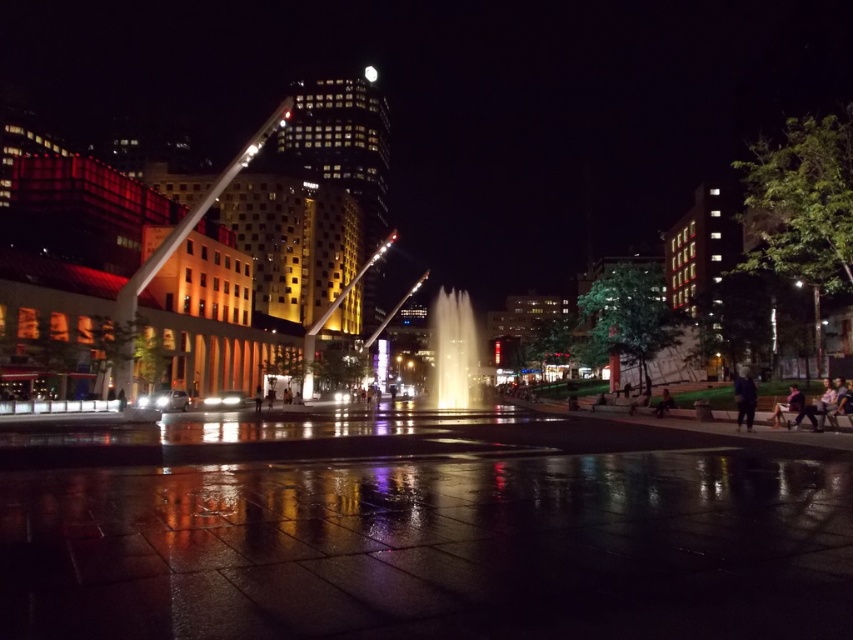
Is illuminated glass fountain at center bigger than white glossy light at center?

Correct, illuminated glass fountain at center is larger in size than white glossy light at center.

Does illuminated glass fountain at center have a greater width compared to white glossy light at center?

Indeed, illuminated glass fountain at center has a greater width compared to white glossy light at center.

Between point (474, 392) and point (373, 67), which one is positioned behind?

Point (373, 67)

Find the location of a particular element. illuminated glass fountain at center is located at coordinates (453, 353).

What do you see at coordinates (744, 397) in the screenshot?
I see `dark blue fabric at lower right` at bounding box center [744, 397].

Does dark blue fabric at lower right have a larger size compared to white glossy light at center?

Incorrect, dark blue fabric at lower right is not larger than white glossy light at center.

Between point (735, 410) and point (368, 80), which one is positioned in front?

Positioned in front is point (735, 410).

In order to click on dark blue fabric at lower right in this screenshot , I will do `click(744, 397)`.

Locate an element on the screen. Image resolution: width=853 pixels, height=640 pixels. illuminated glass fountain at center is located at coordinates (453, 353).

Which is below, illuminated glass fountain at center or dark blue fabric at lower right?

Positioned lower is dark blue fabric at lower right.

Is point (450, 346) positioned behind point (751, 384)?

Yes, point (450, 346) is behind point (751, 384).

I want to click on illuminated glass fountain at center, so click(x=453, y=353).